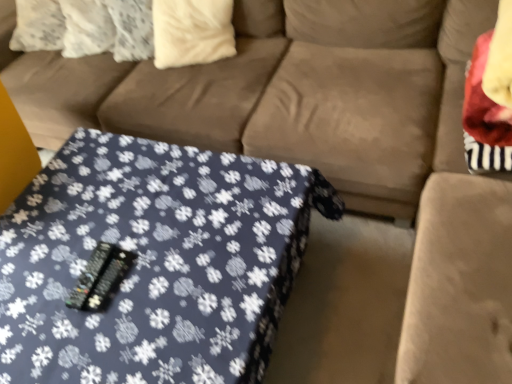
What is the approximate width of white soft pillow at upper center?

The width of white soft pillow at upper center is 11.78 inches.

The height and width of the screenshot is (384, 512). Describe the element at coordinates (192, 31) in the screenshot. I see `white soft pillow at upper center` at that location.

This screenshot has width=512, height=384. Identify the location of white soft pillow at upper center. (192, 31).

Image resolution: width=512 pixels, height=384 pixels. In order to click on blue fabric table at center in this screenshot , I will do `click(153, 262)`.

What do you see at coordinates (153, 262) in the screenshot?
I see `blue fabric table at center` at bounding box center [153, 262].

Find the location of a particular element. white soft pillow at upper center is located at coordinates (192, 31).

Which is more to the left, blue fabric table at center or white soft pillow at upper center?

blue fabric table at center.

Who is more distant, blue fabric table at center or white soft pillow at upper center?

white soft pillow at upper center is further away from the camera.

Does point (103, 324) come closer to viewer compared to point (176, 38)?

That is True.

From the image's perspective, is blue fabric table at center positioned above or below white soft pillow at upper center?

Based on their image positions, blue fabric table at center is located beneath white soft pillow at upper center.

From a real-world perspective, is blue fabric table at center below white soft pillow at upper center?

Yes, from a real-world perspective, blue fabric table at center is under white soft pillow at upper center.

Which of these two, blue fabric table at center or white soft pillow at upper center, is wider?

Wider between the two is blue fabric table at center.

Can you confirm if blue fabric table at center is taller than white soft pillow at upper center?

In fact, blue fabric table at center may be shorter than white soft pillow at upper center.

Between blue fabric table at center and white soft pillow at upper center, which one has larger size?

Bigger between the two is blue fabric table at center.

Is blue fabric table at center spatially inside white soft pillow at upper center, or outside of it?

blue fabric table at center exists outside the volume of white soft pillow at upper center.

Does blue fabric table at center touch white soft pillow at upper center?

No, blue fabric table at center is not in contact with white soft pillow at upper center.

Is blue fabric table at center aimed at white soft pillow at upper center?

No, blue fabric table at center is not facing towards white soft pillow at upper center.

What's the angular difference between blue fabric table at center and white soft pillow at upper center's facing directions?

The angular difference between blue fabric table at center and white soft pillow at upper center is 18.5 degrees.

Image resolution: width=512 pixels, height=384 pixels. In order to click on table that appears on the left of white soft pillow at upper center in this screenshot , I will do `click(153, 262)`.

Can you confirm if white soft pillow at upper center is positioned to the left of blue fabric table at center?

In fact, white soft pillow at upper center is to the right of blue fabric table at center.

Is the depth of white soft pillow at upper center less than that of blue fabric table at center?

No, it is not.

Which point is more forward, (183, 38) or (247, 305)?

The point (247, 305) is in front.

From the image's perspective, is white soft pillow at upper center below blue fabric table at center?

Incorrect, from the image's perspective, white soft pillow at upper center is higher than blue fabric table at center.

From a real-world perspective, is white soft pillow at upper center physically located above or below blue fabric table at center?

white soft pillow at upper center is situated higher than blue fabric table at center in the real world.

Considering the sizes of objects white soft pillow at upper center and blue fabric table at center in the image provided, who is thinner, white soft pillow at upper center or blue fabric table at center?

With smaller width is white soft pillow at upper center.

Considering the sizes of white soft pillow at upper center and blue fabric table at center in the image, is white soft pillow at upper center taller or shorter than blue fabric table at center?

Clearly, white soft pillow at upper center is taller compared to blue fabric table at center.

Can you confirm if white soft pillow at upper center is bigger than blue fabric table at center?

Actually, white soft pillow at upper center might be smaller than blue fabric table at center.

Looking at this image, is white soft pillow at upper center positioned beyond the bounds of blue fabric table at center?

Yes, white soft pillow at upper center is not within blue fabric table at center.

Is white soft pillow at upper center next to blue fabric table at center and touching it?

white soft pillow at upper center is not next to blue fabric table at center, and they're not touching.

Does white soft pillow at upper center turn towards blue fabric table at center?

Yes, white soft pillow at upper center is facing blue fabric table at center.

At what (x,y) coordinates should I click in order to perform the action: click on table that is below the white soft pillow at upper center (from the image's perspective). Please return your answer as a coordinate pair (x, y). The image size is (512, 384). Looking at the image, I should click on (153, 262).

You are a GUI agent. You are given a task and a screenshot of the screen. Output one action in this format:
    pyautogui.click(x=<x>, y=<y>)
    Task: Click on the table located in front of the white soft pillow at upper center
    This screenshot has width=512, height=384.
    Given the screenshot: What is the action you would take?
    pyautogui.click(x=153, y=262)

The width and height of the screenshot is (512, 384). In the image, there is a blue fabric table at center. Find the location of `pillow above it (from the image's perspective)`. pillow above it (from the image's perspective) is located at coordinates (192, 31).